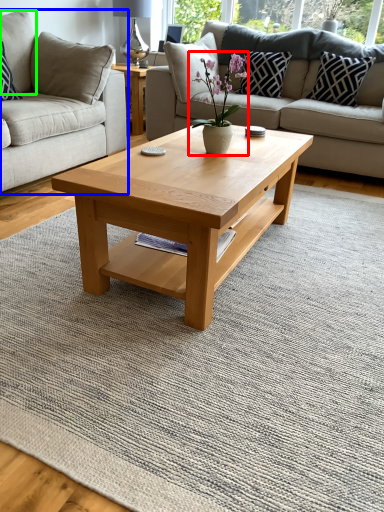
Question: Which object is the closest to the houseplant (highlighted by a red box)? Choose among these: studio couch (highlighted by a blue box) or pillow (highlighted by a green box).

Choices:
 (A) studio couch
 (B) pillow

Answer: (A)